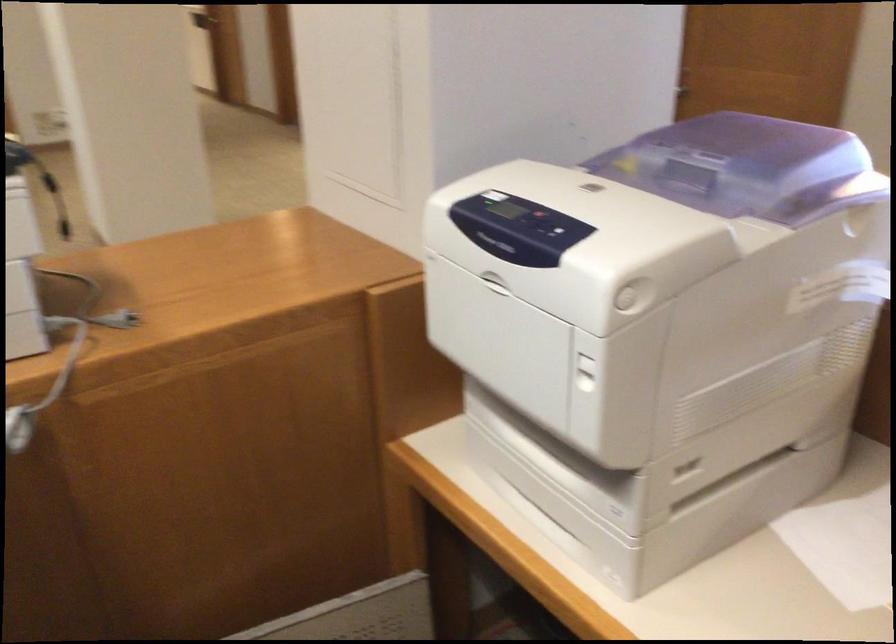
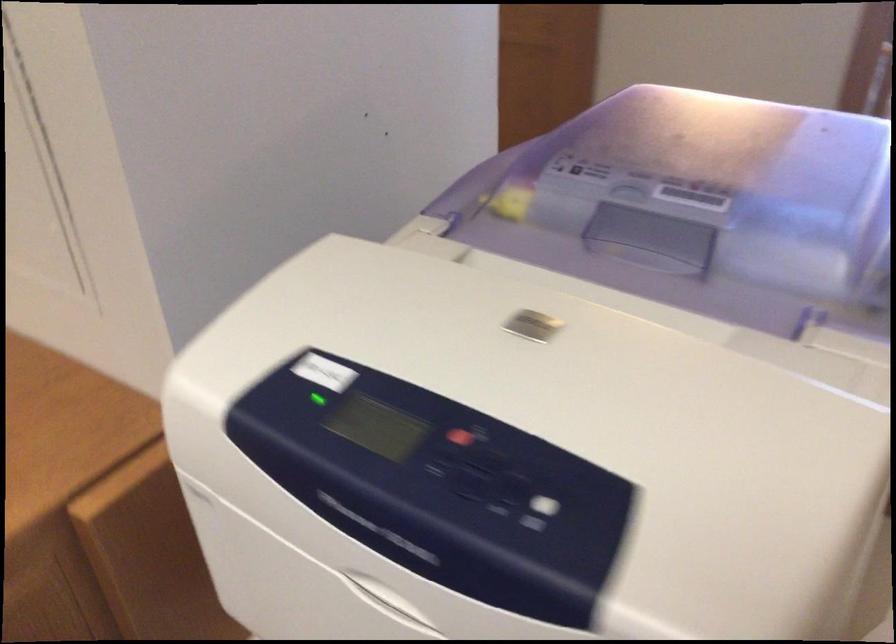
Where in the second image is the point corresponding to the point at 698,172 from the first image?

(656, 234)